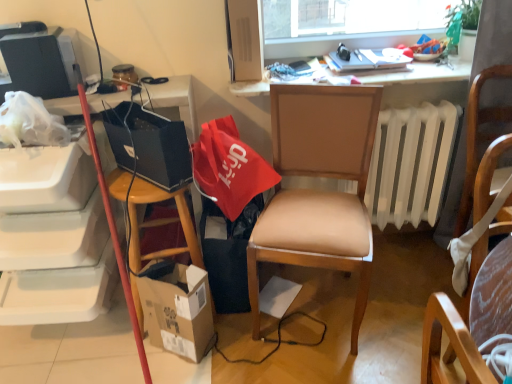
Question: From a real-world perspective, is black fabric trash bin/can at lower center physically located above or below green leafy plant at upper right?

Choices:
 (A) below
 (B) above

Answer: (A)

Question: Is black fabric trash bin/can at lower center situated inside green leafy plant at upper right or outside?

Choices:
 (A) outside
 (B) inside

Answer: (A)

Question: Considering the real-world distances, which object is farthest from the matte black television at upper left?

Choices:
 (A) matte black laptop at left, which ranks as the second handbag in right-to-left order
 (B) matte black laptop at upper center
 (C) black fabric trash bin/can at lower center
 (D) wooden chair at right, marked as the 2th chair in a left-to-right arrangement
 (E) wooden desk at upper center

Answer: (D)

Question: Based on their relative distances, which object is nearer to the matte black television at upper left?

Choices:
 (A) wooden desk at upper center
 (B) matte black laptop at upper center
 (C) cardboard box at lower left
 (D) white plastic radiator at center right
 (E) black fabric trash bin/can at lower center

Answer: (E)